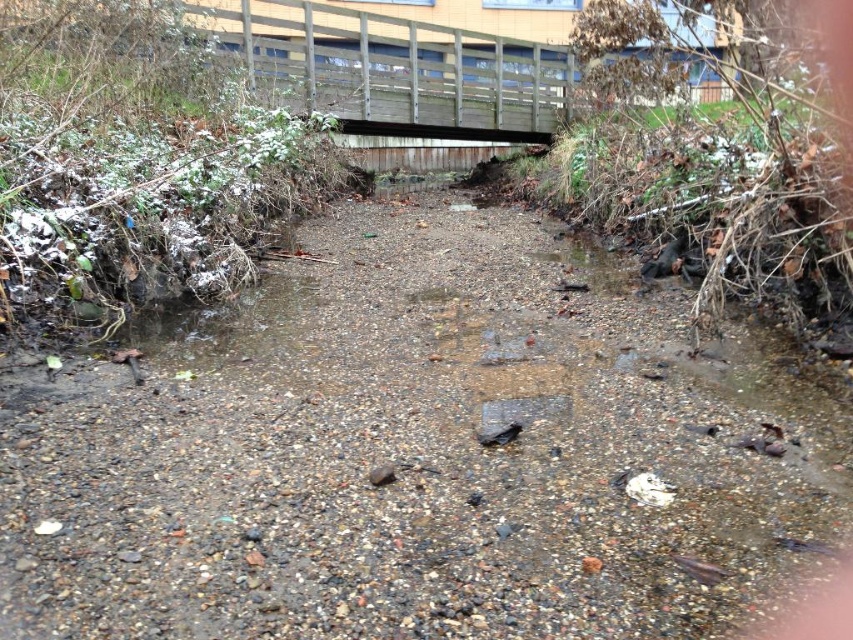
Question: Among these points, which one is farthest from the camera?

Choices:
 (A) (277, 32)
 (B) (370, 387)

Answer: (A)

Question: Which of the following is the closest to the observer?

Choices:
 (A) wooden bridge at upper center
 (B) brown gravel path at center

Answer: (B)

Question: Observing the image, what is the correct spatial positioning of brown gravel path at center in reference to wooden bridge at upper center?

Choices:
 (A) below
 (B) above

Answer: (A)

Question: From the image, what is the correct spatial relationship of brown gravel path at center in relation to wooden bridge at upper center?

Choices:
 (A) right
 (B) left

Answer: (A)

Question: Is the position of brown gravel path at center less distant than that of wooden bridge at upper center?

Choices:
 (A) no
 (B) yes

Answer: (B)